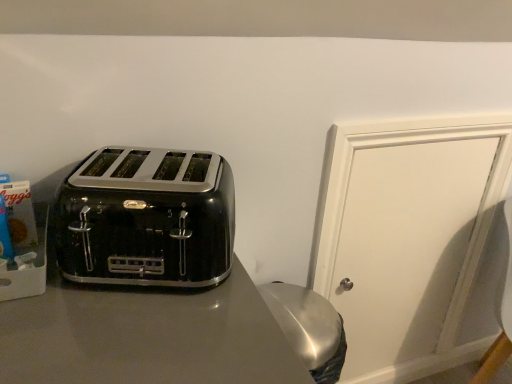
Question: Can you confirm if white matte door at center is positioned to the right of black glossy toaster at left?

Choices:
 (A) yes
 (B) no

Answer: (A)

Question: Is there a large distance between white matte door at center and black glossy toaster at left?

Choices:
 (A) yes
 (B) no

Answer: (B)

Question: Does white matte door at center have a lesser height compared to black glossy toaster at left?

Choices:
 (A) no
 (B) yes

Answer: (A)

Question: Does white matte door at center have a greater width compared to black glossy toaster at left?

Choices:
 (A) yes
 (B) no

Answer: (B)

Question: From the image's perspective, is white matte door at center beneath black glossy toaster at left?

Choices:
 (A) no
 (B) yes

Answer: (B)

Question: From a real-world perspective, is white matte door at center located higher than black glossy toaster at left?

Choices:
 (A) no
 (B) yes

Answer: (A)

Question: Does black glossy toaster at left have a lesser width compared to white matte door at center?

Choices:
 (A) no
 (B) yes

Answer: (A)

Question: Can you confirm if black glossy toaster at left is taller than white matte door at center?

Choices:
 (A) yes
 (B) no

Answer: (B)

Question: From a real-world perspective, is black glossy toaster at left located beneath white matte door at center?

Choices:
 (A) no
 (B) yes

Answer: (A)

Question: Can you confirm if black glossy toaster at left is positioned to the right of white matte door at center?

Choices:
 (A) no
 (B) yes

Answer: (A)

Question: Can you confirm if black glossy toaster at left is wider than white matte door at center?

Choices:
 (A) no
 (B) yes

Answer: (B)

Question: Does black glossy toaster at left have a smaller size compared to white matte door at center?

Choices:
 (A) no
 (B) yes

Answer: (B)

Question: Looking at their shapes, would you say white matte door at center is wider or thinner than black glossy toaster at left?

Choices:
 (A) wide
 (B) thin

Answer: (B)